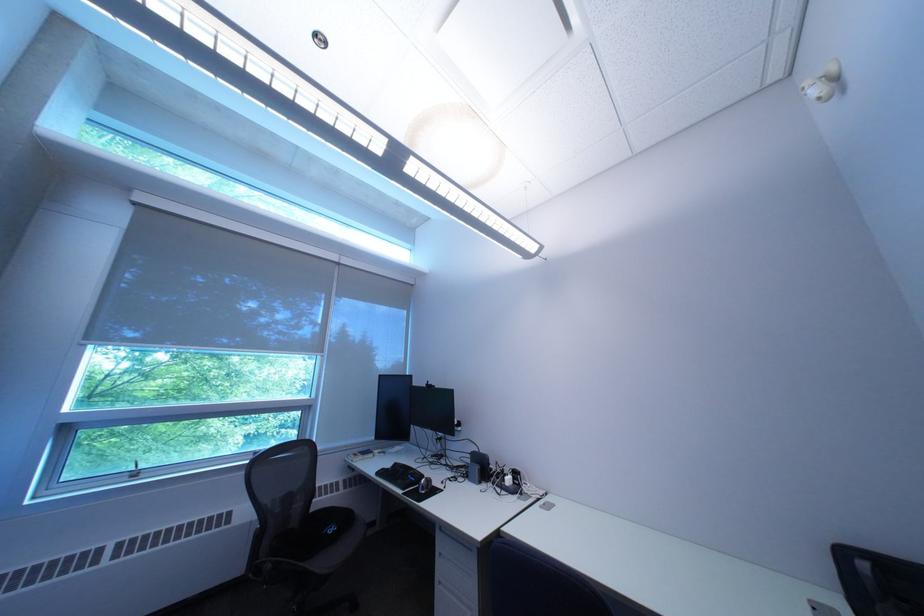
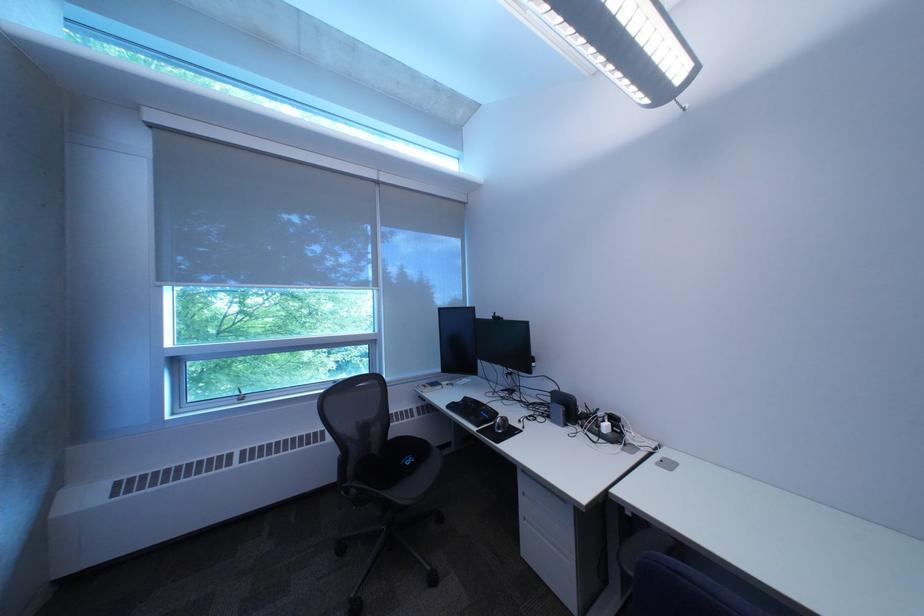
Locate, in the second image, the point that corresponds to [393,475] in the first image.

(464, 408)